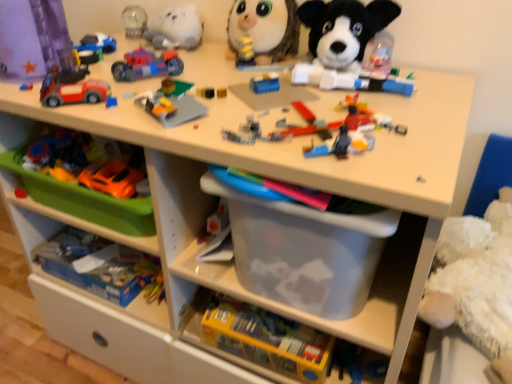
The width and height of the screenshot is (512, 384). I want to click on vacant point to the right of translucent plastic motorcycle at upper center, placed as the fourth toy when sorted from top to bottom, so [x=241, y=78].